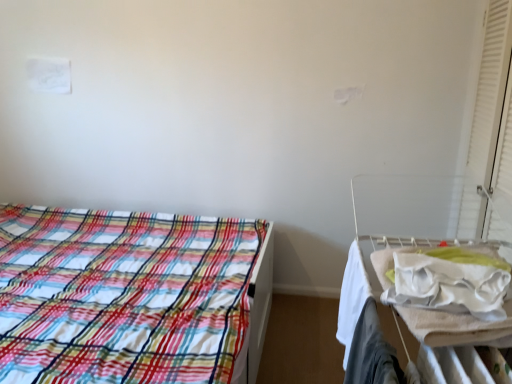
Question: From the image's perspective, is white matte curtain at right on plaid fabric bed at left?

Choices:
 (A) no
 (B) yes

Answer: (B)

Question: From the image's perspective, is white matte curtain at right under plaid fabric bed at left?

Choices:
 (A) yes
 (B) no

Answer: (B)

Question: Is white matte curtain at right to the left of plaid fabric bed at left from the viewer's perspective?

Choices:
 (A) no
 (B) yes

Answer: (A)

Question: Does white matte curtain at right have a lesser height compared to plaid fabric bed at left?

Choices:
 (A) no
 (B) yes

Answer: (A)

Question: Is white matte curtain at right behind plaid fabric bed at left?

Choices:
 (A) yes
 (B) no

Answer: (A)

Question: Considering the positions of white fabric at right and white matte curtain at right in the image, is white fabric at right wider or thinner than white matte curtain at right?

Choices:
 (A) thin
 (B) wide

Answer: (B)

Question: Considering the relative positions of white fabric at right and white matte curtain at right in the image provided, is white fabric at right to the left or to the right of white matte curtain at right?

Choices:
 (A) right
 (B) left

Answer: (B)

Question: Would you say white fabric at right is inside or outside white matte curtain at right?

Choices:
 (A) inside
 (B) outside

Answer: (B)

Question: From a real-world perspective, is white fabric at right above or below white matte curtain at right?

Choices:
 (A) below
 (B) above

Answer: (A)

Question: From the image's perspective, is white matte curtain at right located above or below white fabric hospital bed at right?

Choices:
 (A) below
 (B) above

Answer: (B)

Question: Considering the positions of white matte curtain at right and white fabric hospital bed at right in the image, is white matte curtain at right taller or shorter than white fabric hospital bed at right?

Choices:
 (A) short
 (B) tall

Answer: (B)

Question: Would you say white matte curtain at right is to the left or to the right of white fabric hospital bed at right in the picture?

Choices:
 (A) right
 (B) left

Answer: (A)

Question: From a real-world perspective, is white matte curtain at right above or below white fabric hospital bed at right?

Choices:
 (A) below
 (B) above

Answer: (B)

Question: From the image's perspective, is plaid fabric bed at left located above or below white fabric at right?

Choices:
 (A) below
 (B) above

Answer: (A)

Question: From a real-world perspective, is plaid fabric bed at left positioned above or below white fabric at right?

Choices:
 (A) above
 (B) below

Answer: (B)